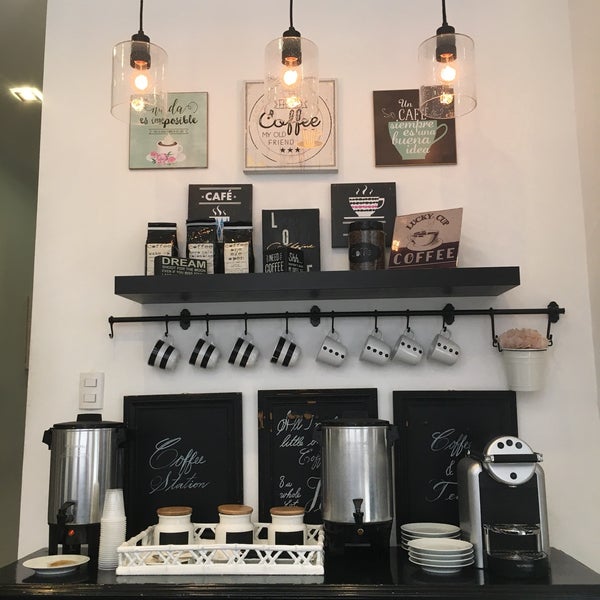
I want to click on white and black spotted ceramic mugs, so click(x=327, y=338), click(x=370, y=337), click(x=403, y=338), click(x=439, y=337).